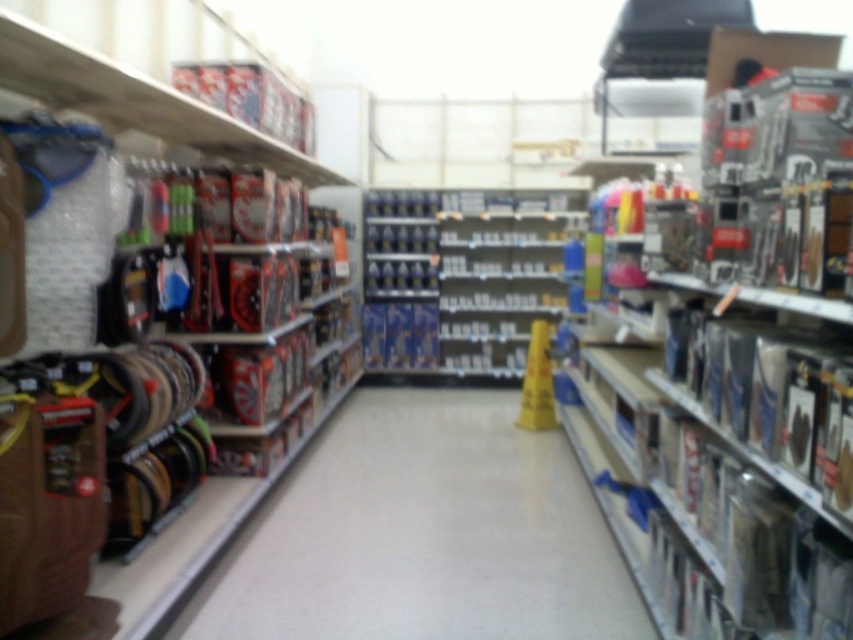
Can you confirm if smooth plastic aisle at center is shorter than metallic silver tools at left?

Yes.

Is point (496, 518) less distant than point (137, 81)?

No, (496, 518) is further to viewer.

Which is behind, point (570, 547) or point (306, 166)?

The point (306, 166) is behind.

Where is `smooth plastic aisle at center`? Image resolution: width=853 pixels, height=640 pixels. smooth plastic aisle at center is located at coordinates (422, 534).